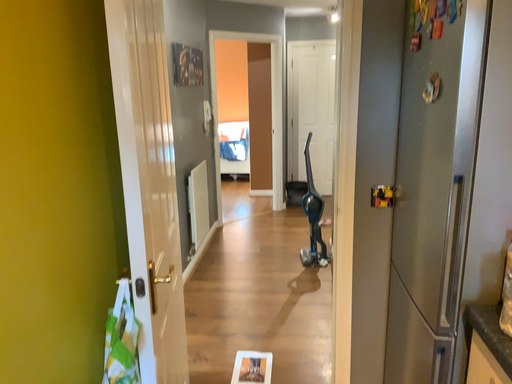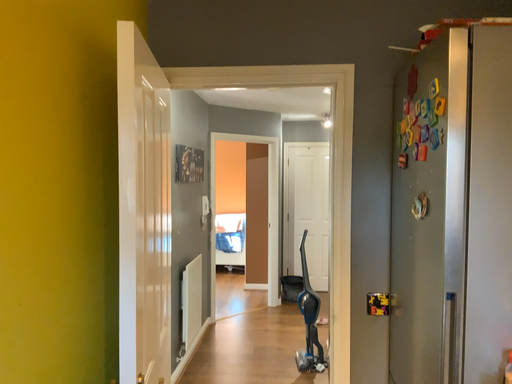
Question: How did the camera likely rotate when shooting the video?

Choices:
 (A) rotated downward
 (B) rotated upward

Answer: (B)